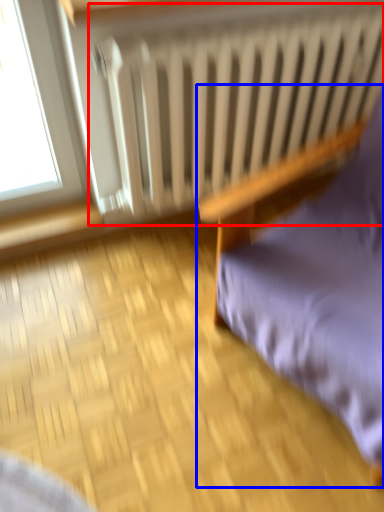
Question: Which of the following is the farthest to the observer, radiator (highlighted by a red box) or furniture (highlighted by a blue box)?

Choices:
 (A) radiator
 (B) furniture

Answer: (A)